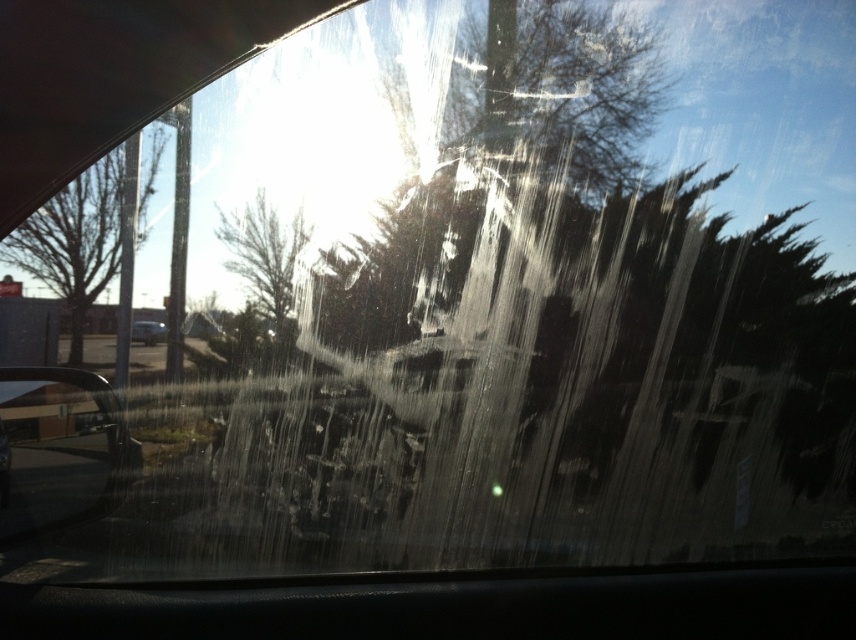
Between point (146, 228) and point (289, 324), which one is positioned behind?

Positioned behind is point (146, 228).

Who is higher up, bare branches at left or green leafy tree at center?

bare branches at left is higher up.

Locate an element on the screen. The width and height of the screenshot is (856, 640). bare branches at left is located at coordinates (74, 241).

Locate an element on the screen. bare branches at left is located at coordinates (74, 241).

Locate an element on the screen. green leafy tree at center is located at coordinates (265, 259).

How distant is green leafy tree at center from metallic silver car at lower left?

A distance of 3.75 feet exists between green leafy tree at center and metallic silver car at lower left.

Where is `green leafy tree at center`? The width and height of the screenshot is (856, 640). green leafy tree at center is located at coordinates (265, 259).

The height and width of the screenshot is (640, 856). Describe the element at coordinates (74, 241) in the screenshot. I see `bare branches at left` at that location.

Can you confirm if bare branches at left is smaller than metallic silver car at lower left?

No, bare branches at left is not smaller than metallic silver car at lower left.

At what (x,y) coordinates should I click in order to perform the action: click on bare branches at left. Please return your answer as a coordinate pair (x, y). Looking at the image, I should click on (74, 241).

Where is `bare branches at left`? The image size is (856, 640). bare branches at left is located at coordinates (74, 241).